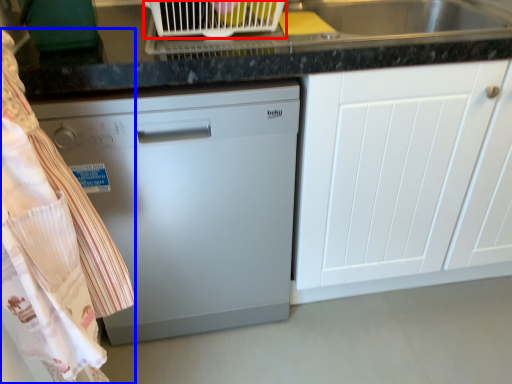
Question: Which point is closer to the camera, appliance (highlighted by a red box) or laundry (highlighted by a blue box)?

Choices:
 (A) appliance
 (B) laundry

Answer: (B)